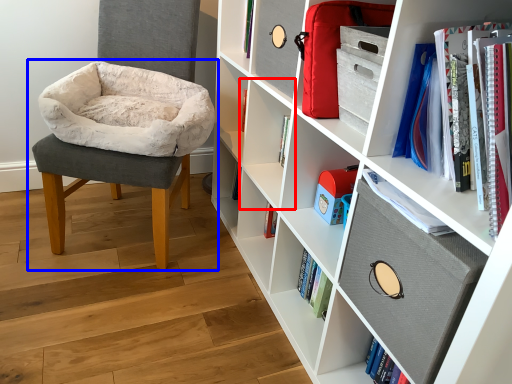
Question: Which object is further to the camera taking this photo, shelf (highlighted by a red box) or chair (highlighted by a blue box)?

Choices:
 (A) shelf
 (B) chair

Answer: (A)